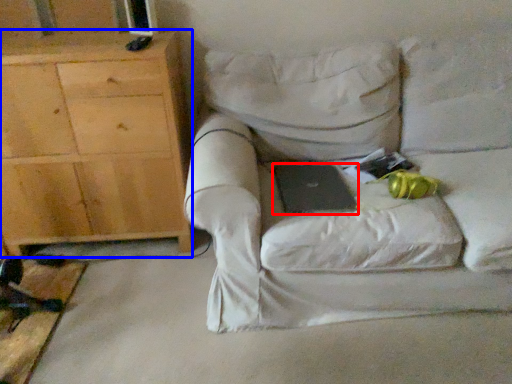
Question: Among these objects, which one is farthest to the camera, laptop (highlighted by a red box) or cabinetry (highlighted by a blue box)?

Choices:
 (A) laptop
 (B) cabinetry

Answer: (B)